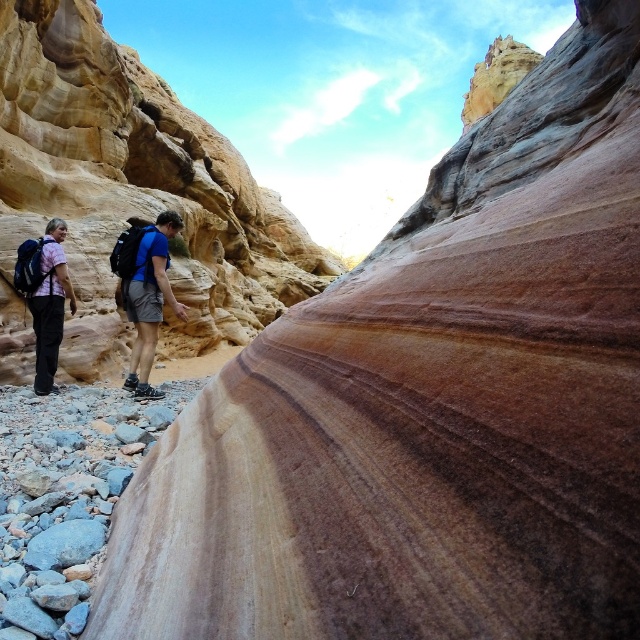
Question: Considering the real-world distances, which object is closest to the matte blue shirt at center?

Choices:
 (A) smooth sandstone rock at left
 (B) matte pink shirt at left

Answer: (B)

Question: Is blue fabric backpack at center positioned in front of matte pink shirt at left?

Choices:
 (A) no
 (B) yes

Answer: (A)

Question: Which object appears farthest from the camera in this image?

Choices:
 (A) blue fabric backpack at center
 (B) matte pink shirt at left

Answer: (A)

Question: Which object is positioned closest to the smooth sandstone rock at left?

Choices:
 (A) matte pink shirt at left
 (B) matte blue shirt at center

Answer: (B)

Question: Is blue fabric backpack at center above matte pink shirt at left?

Choices:
 (A) no
 (B) yes

Answer: (B)

Question: Does blue fabric backpack at center appear over matte pink shirt at left?

Choices:
 (A) yes
 (B) no

Answer: (A)